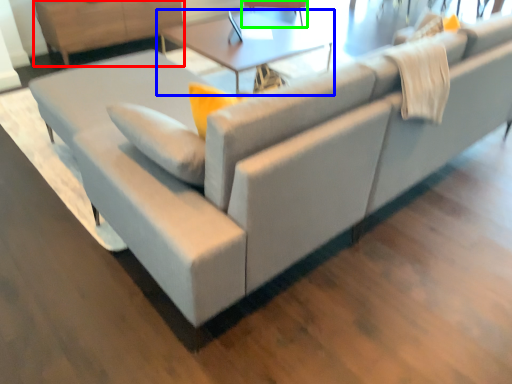
Question: Which is nearer to the dresser (highlighted by a red box)? table (highlighted by a blue box) or swivel chair (highlighted by a green box).

Choices:
 (A) table
 (B) swivel chair

Answer: (A)